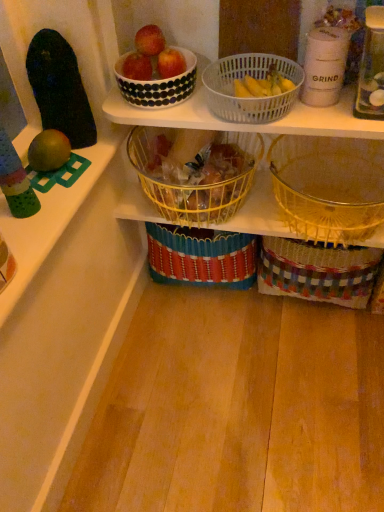
Question: Should I look upward or downward to see transparent plastic bottle at upper right?

Choices:
 (A) down
 (B) up

Answer: (B)

Question: Considering the relative positions of yellow wire basket at center, positioned as the first basket in left-to-right order, and white dotted bowl at upper center in the image provided, is yellow wire basket at center, positioned as the first basket in left-to-right order, behind white dotted bowl at upper center?

Choices:
 (A) yes
 (B) no

Answer: (A)

Question: Is yellow wire basket at center, positioned as the first basket in left-to-right order, bigger than white dotted bowl at upper center?

Choices:
 (A) yes
 (B) no

Answer: (A)

Question: Is yellow wire basket at center, positioned as the first basket in left-to-right order, positioned far away from white dotted bowl at upper center?

Choices:
 (A) yes
 (B) no

Answer: (B)

Question: From the image's perspective, is yellow wire basket at center, positioned as the first basket in left-to-right order, below white dotted bowl at upper center?

Choices:
 (A) yes
 (B) no

Answer: (A)

Question: From a real-world perspective, is yellow wire basket at center, marked as the third basket in a right-to-left arrangement, under white dotted bowl at upper center?

Choices:
 (A) no
 (B) yes

Answer: (B)

Question: Does yellow wire basket at center, marked as the third basket in a right-to-left arrangement, appear on the left side of white dotted bowl at upper center?

Choices:
 (A) yes
 (B) no

Answer: (B)

Question: Considering the relative sizes of yellow plastic bananas at upper center and woven multicolored basket at lower right in the image provided, is yellow plastic bananas at upper center shorter than woven multicolored basket at lower right?

Choices:
 (A) yes
 (B) no

Answer: (A)

Question: Can you confirm if yellow plastic bananas at upper center is bigger than woven multicolored basket at lower right?

Choices:
 (A) no
 (B) yes

Answer: (A)

Question: Considering the relative positions of yellow plastic bananas at upper center and woven multicolored basket at lower right in the image provided, is yellow plastic bananas at upper center to the right of woven multicolored basket at lower right from the viewer's perspective?

Choices:
 (A) yes
 (B) no

Answer: (B)

Question: Is yellow plastic bananas at upper center thinner than woven multicolored basket at lower right?

Choices:
 (A) yes
 (B) no

Answer: (A)

Question: Can you confirm if yellow plastic bananas at upper center is taller than woven multicolored basket at lower right?

Choices:
 (A) yes
 (B) no

Answer: (B)

Question: From a real-world perspective, is yellow plastic bananas at upper center positioned under woven multicolored basket at lower right based on gravity?

Choices:
 (A) no
 (B) yes

Answer: (A)

Question: Considering the relative sizes of matte black bowl at upper center, positioned as the 1th apple in left-to-right order, and yellow wire basket at center, marked as the third basket in a right-to-left arrangement, in the image provided, is matte black bowl at upper center, positioned as the 1th apple in left-to-right order, shorter than yellow wire basket at center, marked as the third basket in a right-to-left arrangement,?

Choices:
 (A) no
 (B) yes

Answer: (B)